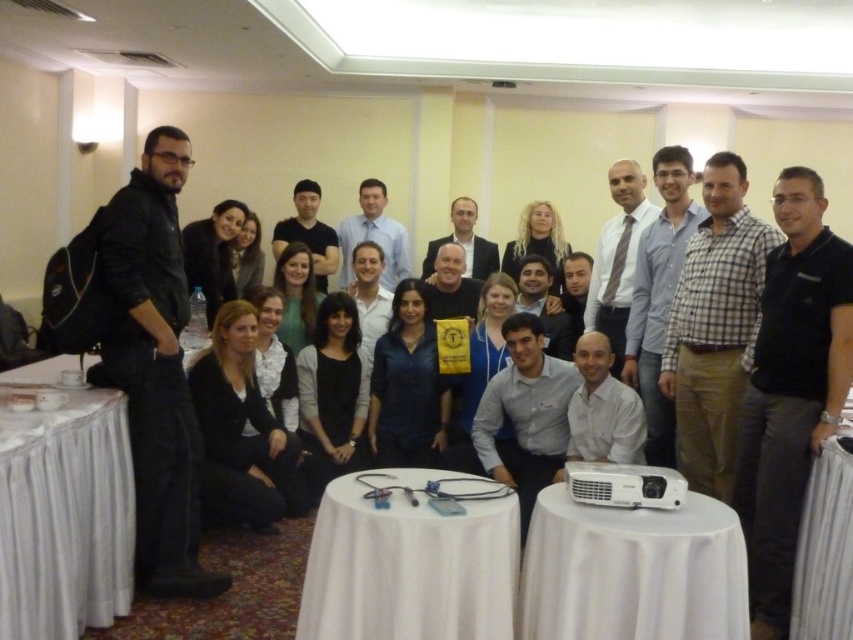
Is white fabric tablecloth at lower left smaller than white cloth at lower right?

No, white fabric tablecloth at lower left is not smaller than white cloth at lower right.

Is white fabric tablecloth at lower left closer to camera compared to white cloth at lower right?

Yes, it is.

You are a GUI agent. You are given a task and a screenshot of the screen. Output one action in this format:
    pyautogui.click(x=<x>, y=<y>)
    Task: Click on the white fabric tablecloth at lower left
    The width and height of the screenshot is (853, 640).
    Given the screenshot: What is the action you would take?
    pyautogui.click(x=62, y=509)

Between point (144, 355) and point (850, 595), which one is positioned in front?

Point (850, 595) is in front.

Does black leather jacket at left have a lesser height compared to white cloth at lower right?

Incorrect, black leather jacket at left's height does not fall short of white cloth at lower right's.

Is point (166, 202) positioned after point (822, 444)?

Yes, point (166, 202) is farther from viewer.

Locate an element on the screen. black leather jacket at left is located at coordinates (155, 365).

Can you confirm if black cotton polo shirt at center is shorter than white cloth at lower right?

No, black cotton polo shirt at center is not shorter than white cloth at lower right.

Image resolution: width=853 pixels, height=640 pixels. What are the coordinates of `black cotton polo shirt at center` in the screenshot? It's located at [x=791, y=388].

At what (x,y) coordinates should I click in order to perform the action: click on black cotton polo shirt at center. Please return your answer as a coordinate pair (x, y). Image resolution: width=853 pixels, height=640 pixels. Looking at the image, I should click on (791, 388).